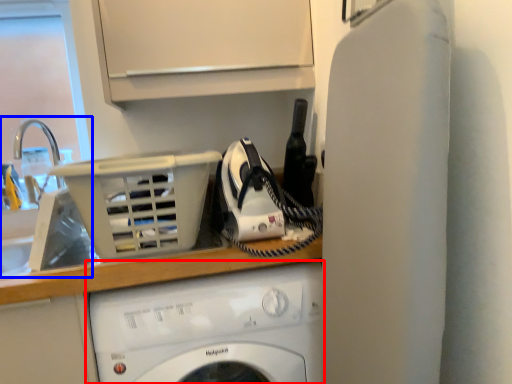
Question: Which object appears farthest to the camera in this image, washing machine (highlighted by a red box) or sink (highlighted by a blue box)?

Choices:
 (A) washing machine
 (B) sink

Answer: (B)